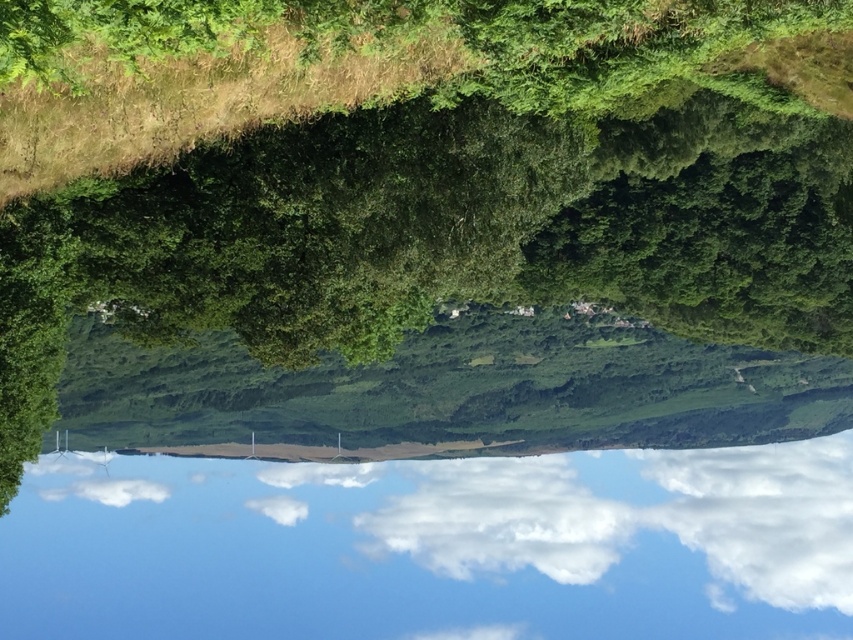
Based on the scene described, if you were standing at the bottom of the slope where the dense clusters of trees are, which object would appear in front of the other when looking towards the upper center? Would it be the green leafy tree at upper center or the white fluffy cloud at upper center?

The green leafy tree at upper center is closer to the viewer than the white fluffy cloud at upper center, so the green leafy tree at upper center would appear in front of the white fluffy cloud at upper center when looking towards the upper center.

From the picture: You are standing in the serene landscape looking at the green leafy tree at upper center and the white fluffy cloud at upper center. Which object is positioned to the left when viewed from your perspective?

The green leafy tree at upper center is positioned to the left of the white fluffy cloud at upper center.